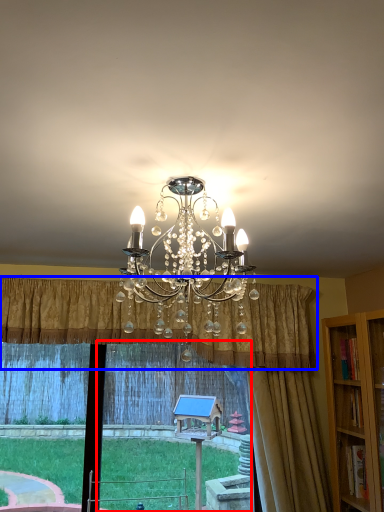
Question: Which point is closer to the camera, window frame (highlighted by a red box) or curtain (highlighted by a blue box)?

Choices:
 (A) window frame
 (B) curtain

Answer: (B)